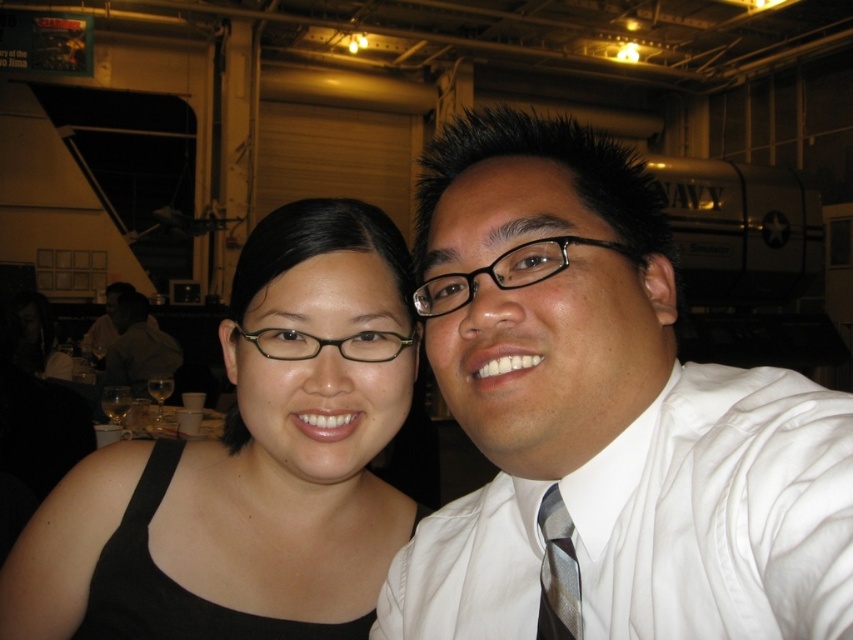
You are a photographer adjusting the lighting for a portrait. You notice the silver striped tie at right and the matte black glasses at center in the frame. Which object would cast a narrower shadow if the light source is positioned directly above them?

The silver striped tie at right has a lesser width compared to the matte black glasses at center, so it would cast a narrower shadow.

Looking at this image, you are a photographer adjusting the camera settings to ensure both the black matte glasses at upper left and the matte black glasses at center are in focus. Which glasses should you adjust the focus to prioritize based on their height?

The black matte glasses at upper left is taller than the matte black glasses at center, so you should prioritize focusing on the black matte glasses at upper left to ensure clarity due to its greater height.

You are a photographer trying to focus on the white satin shirt at center. According to the coordinates provided, where exactly should you adjust your camera lens to aim?

The white satin shirt at center is located at coordinates point (605, 416), so you should adjust your camera lens to aim at that exact point to focus on it.